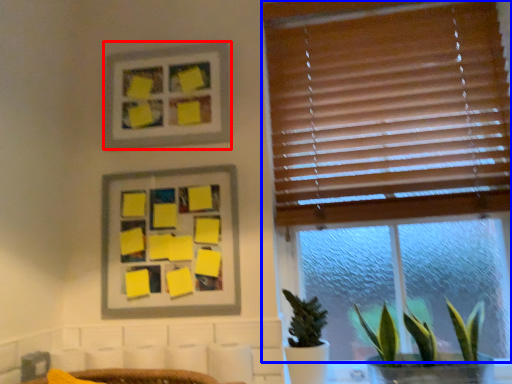
Question: Which point is closer to the camera, picture frame (highlighted by a red box) or window (highlighted by a blue box)?

Choices:
 (A) picture frame
 (B) window

Answer: (B)